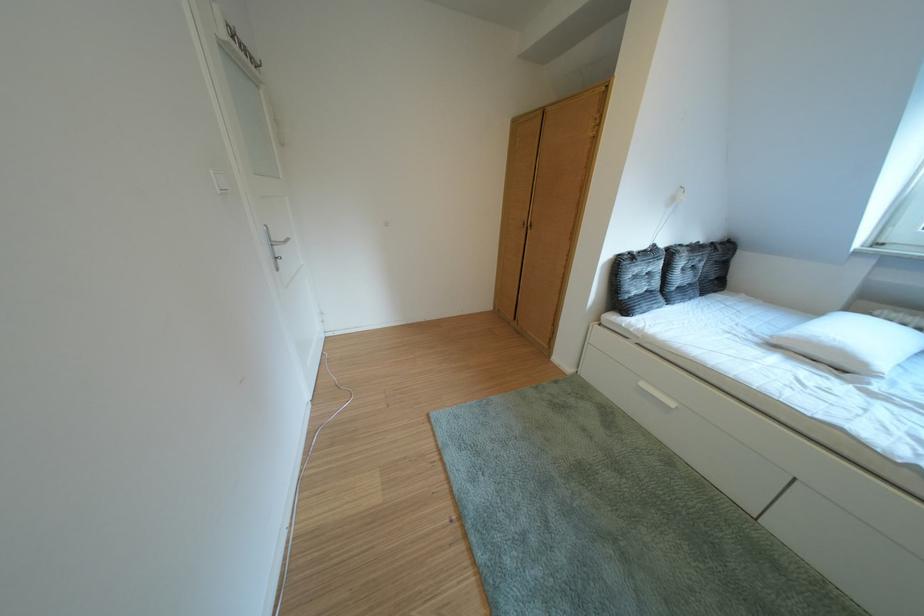
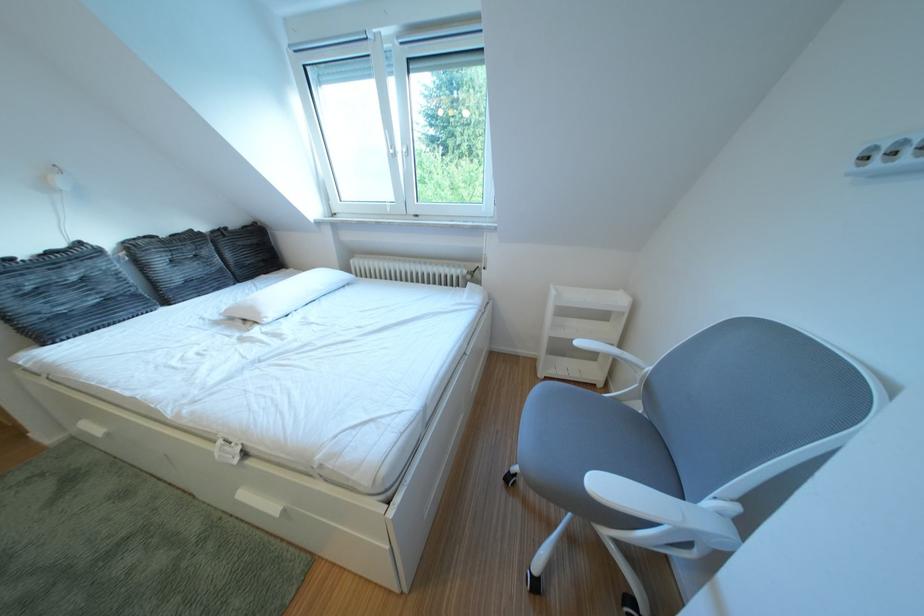
Locate, in the second image, the point that corresponds to (x=669, y=251) in the first image.

(93, 249)